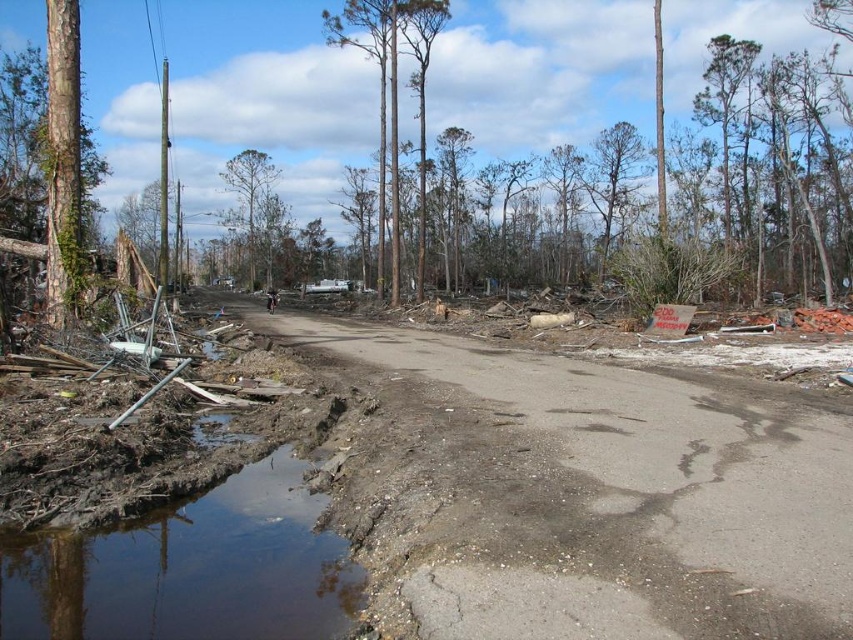
Between muddy water at lower left and brown bark tree at center, which one appears on the left side from the viewer's perspective?

muddy water at lower left

Is muddy water at lower left behind brown bark tree at center?

No.

Image resolution: width=853 pixels, height=640 pixels. I want to click on muddy water at lower left, so pyautogui.click(x=192, y=570).

Does brown bark tree at center appear under brown rough tree at center?

Indeed, brown bark tree at center is positioned under brown rough tree at center.

This screenshot has width=853, height=640. Describe the element at coordinates (610, 179) in the screenshot. I see `brown bark tree at center` at that location.

Locate an element on the screen. This screenshot has height=640, width=853. brown bark tree at center is located at coordinates (610, 179).

Is brown rough textured trees at center behind brown bark tree at center?

That is False.

Does brown rough textured trees at center appear over brown bark tree at center?

Yes, brown rough textured trees at center is above brown bark tree at center.

What do you see at coordinates (393, 93) in the screenshot?
I see `brown rough textured trees at center` at bounding box center [393, 93].

Find the location of a particular element. The width and height of the screenshot is (853, 640). brown rough textured trees at center is located at coordinates (393, 93).